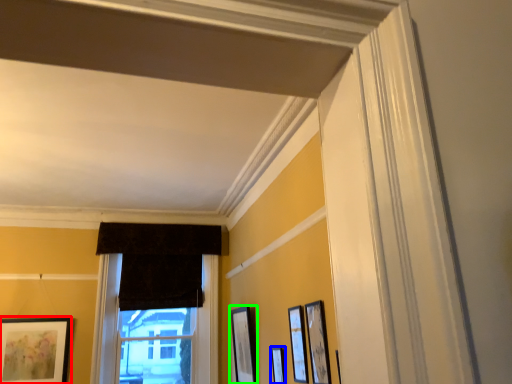
Question: Based on their relative distances, which object is farther from picture frame (highlighted by a red box)? Choose from picture frame (highlighted by a blue box) and picture frame (highlighted by a green box).

Choices:
 (A) picture frame
 (B) picture frame

Answer: (A)